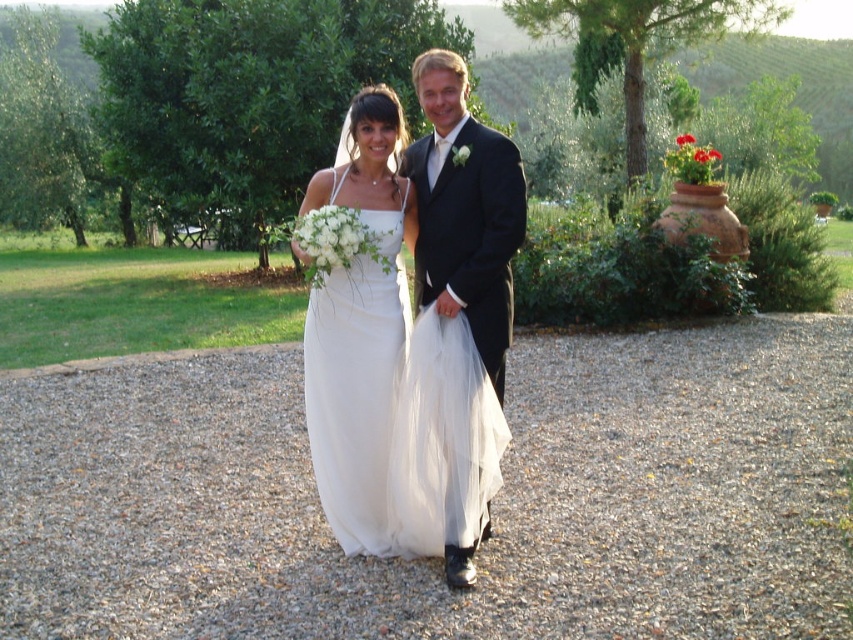
Question: Can you confirm if white tulle dress at center is bigger than white satin dress at center?

Choices:
 (A) no
 (B) yes

Answer: (B)

Question: Among these points, which one is farthest from the camera?

Choices:
 (A) (148, 388)
 (B) (426, 173)

Answer: (A)

Question: Is white tulle dress at center bigger than white satin dress at center?

Choices:
 (A) yes
 (B) no

Answer: (A)

Question: Is white tulle dress at center smaller than black satin suit at center?

Choices:
 (A) yes
 (B) no

Answer: (B)

Question: Which object is positioned closest to the white satin dress at center?

Choices:
 (A) white tulle dress at center
 (B) gray gravel at center

Answer: (A)

Question: Which object is farther from the camera taking this photo?

Choices:
 (A) white tulle dress at center
 (B) white satin dress at center

Answer: (B)